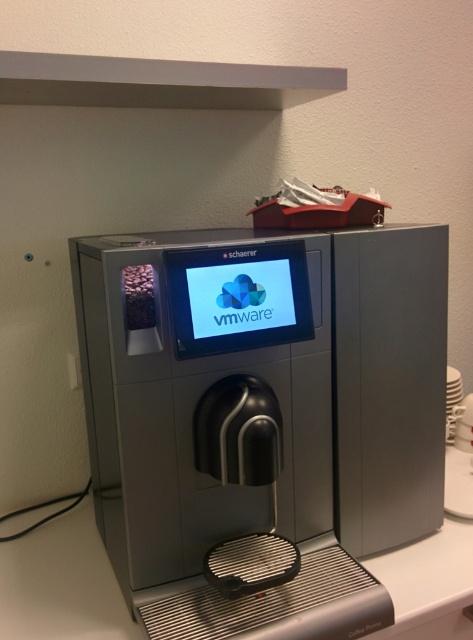
You are a barista who needs to place a large coffee pot on the counter. Based on the scene, will the satin silver coffee machine at center leave enough space on the white glossy counter top at center for the pot?

The satin silver coffee machine at center has a larger size compared to white glossy counter top at center, so it may take up most of the counter space. There might not be enough room for the large coffee pot.

You are a barista who needs to place a new coffee machine on the counter. The existing satin silver coffee machine at center is already above the white glossy counter top at center. Can you place the new machine directly in front of the existing one without moving the current machine?

The satin silver coffee machine at center is located above white glossy counter top at center, so placing the new machine directly in front would require space in front of the existing machine. Since the description only mentions the existing machine being above the counter, there might be enough space in front unless blocked by other objects. However, the provided scene does not mention any obstructions. Therefore, it should be possible to place the new machine in front as long as there is sufficient space